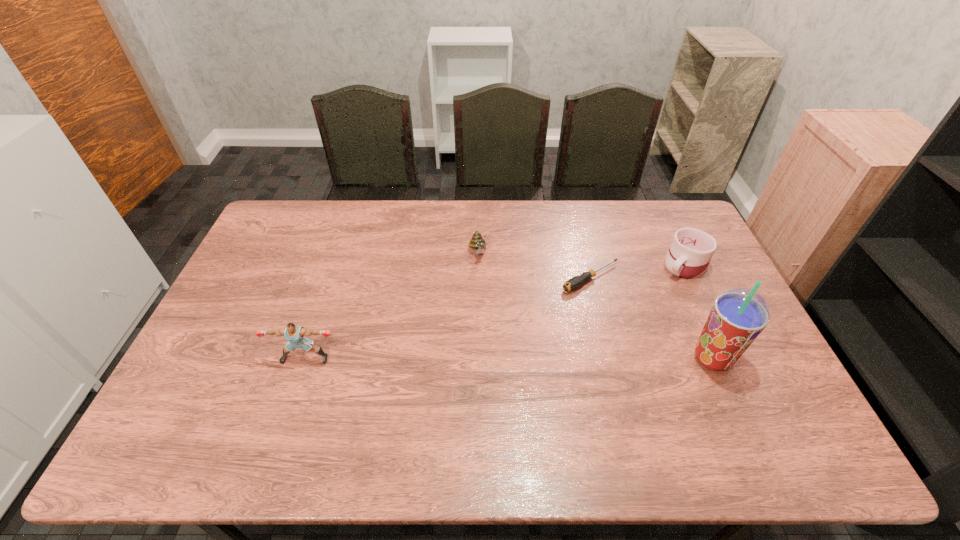
Find the location of `free space between the shortest object and the fourth shortest object`. free space between the shortest object and the fourth shortest object is located at coordinates (448, 318).

This screenshot has height=540, width=960. I want to click on free point between the mug and the puncher, so 495,312.

Find the location of a particular element. The image size is (960, 540). vacant point located between the smoothie and the snail is located at coordinates (595, 306).

Find the location of a particular element. This screenshot has width=960, height=540. free space between the puncher and the fourth object from right to left is located at coordinates (392, 306).

This screenshot has width=960, height=540. I want to click on free space that is in between the screwdriver and the snail, so click(x=535, y=266).

Select which object appears as the second closest to the puncher. Please provide its 2D coordinates. Your answer should be formatted as a tuple, i.e. [(x, y)], where the tuple contains the x and y coordinates of a point satisfying the conditions above.

[(575, 282)]

Identify the location of the closest object to the snail. (575, 282).

Find the location of a particular element. Image resolution: width=960 pixels, height=540 pixels. vacant space that satisfies the following two spatial constraints: 1. on the front side of the snail; 2. on the left side of the smoothie is located at coordinates (477, 359).

I want to click on blank area in the image that satisfies the following two spatial constraints: 1. on the back side of the mug; 2. on the right side of the smoothie, so click(671, 266).

Image resolution: width=960 pixels, height=540 pixels. In order to click on blank space that satisfies the following two spatial constraints: 1. on the front side of the screwdriver; 2. on the right side of the tallest object in this screenshot , I will do `click(611, 359)`.